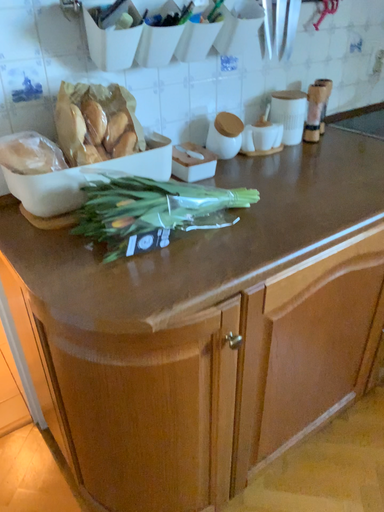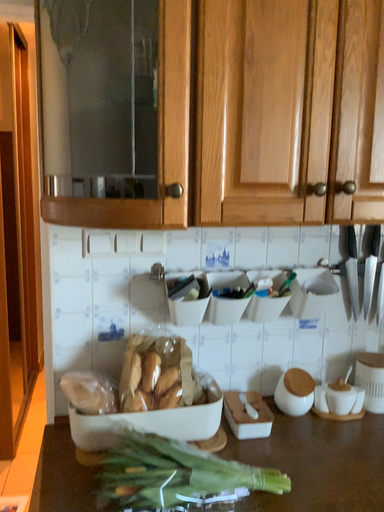
Question: How did the camera likely rotate when shooting the video?

Choices:
 (A) rotated right
 (B) rotated left

Answer: (B)